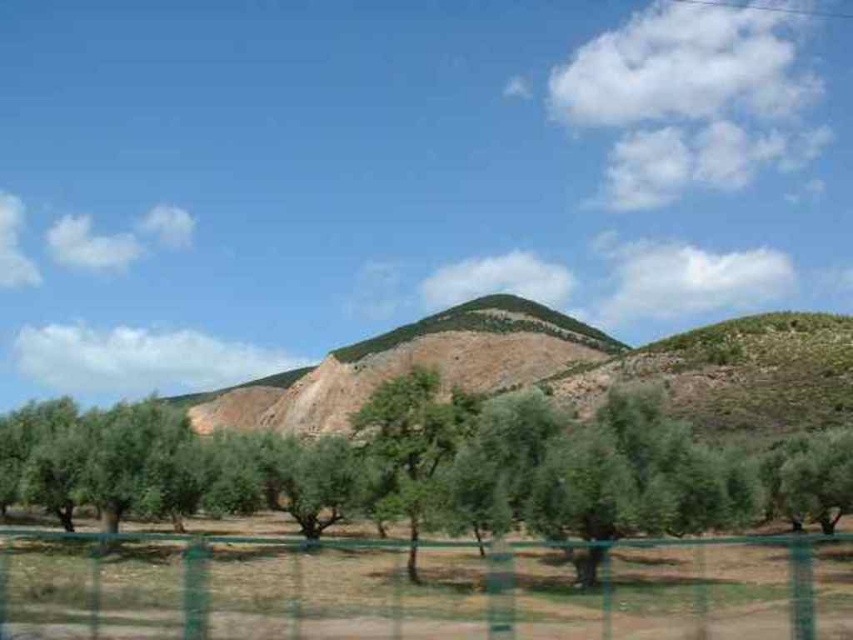
Which is more to the left, green leafy tree at center or green wire mesh fence at lower center?

green leafy tree at center

Describe the element at coordinates (428, 468) in the screenshot. I see `green leafy tree at center` at that location.

Between point (587, 524) and point (697, 604), which one is positioned behind?

Point (587, 524)

Where is `green leafy tree at center`? green leafy tree at center is located at coordinates (428, 468).